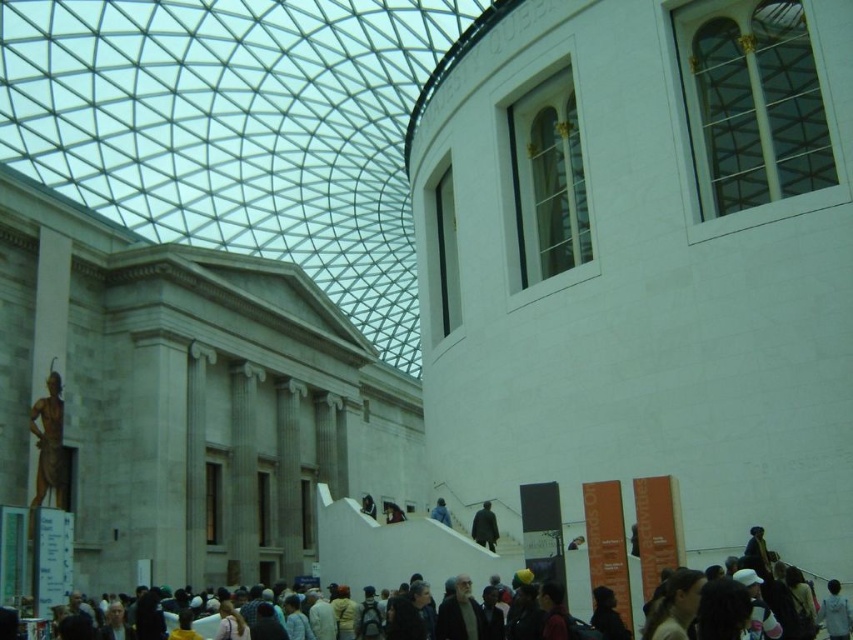
Question: Where is gold metallic statue at left located in relation to dark blue fabric at center in the image?

Choices:
 (A) below
 (B) above

Answer: (B)

Question: Is dark blue jacket at lower center wider than light blue fabric at center?

Choices:
 (A) no
 (B) yes

Answer: (B)

Question: Which object is positioned closest to the dark blue fabric at center?

Choices:
 (A) light blue fabric at center
 (B) gold metallic statue at left

Answer: (A)

Question: Considering the real-world distances, which object is closest to the gold metallic statue at left?

Choices:
 (A) dark blue fabric at center
 (B) light blue fabric at center
 (C) dark blue jacket at lower center

Answer: (B)

Question: Among these objects, which one is nearest to the camera?

Choices:
 (A) light blue fabric at center
 (B) dark blue fabric at center
 (C) gold metallic statue at left

Answer: (A)

Question: Can you confirm if gold metallic statue at left is positioned to the left of dark blue fabric at center?

Choices:
 (A) yes
 (B) no

Answer: (A)